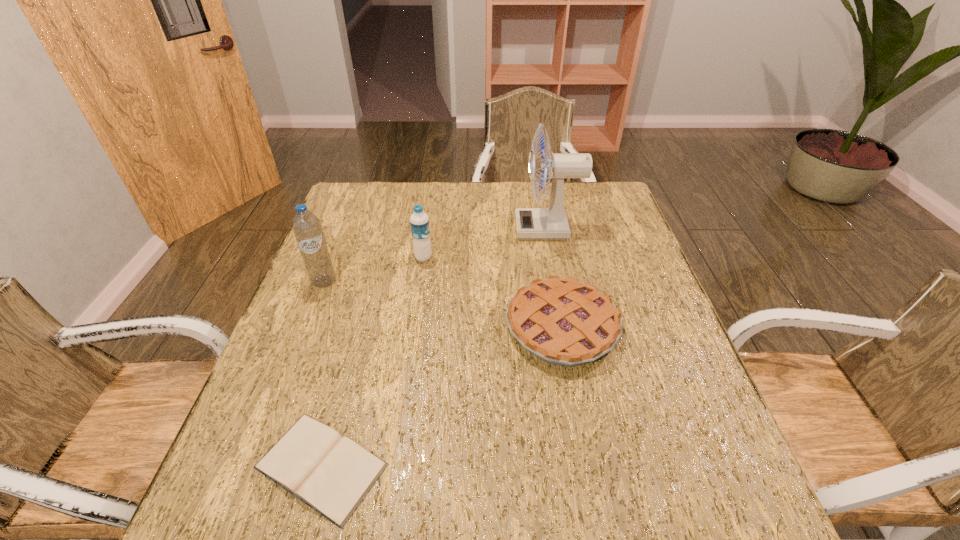
The image size is (960, 540). I want to click on free spot that satisfies the following two spatial constraints: 1. on the front-facing side of the tallest object; 2. on the front side of the shortest object, so click(592, 466).

I want to click on free spot that satisfies the following two spatial constraints: 1. on the label of the third shortest object; 2. on the left side of the pie, so click(413, 328).

What are the coordinates of `vacant space that satisfies the following two spatial constraints: 1. on the front-facing side of the fan; 2. on the front side of the pie` in the screenshot? It's located at (566, 328).